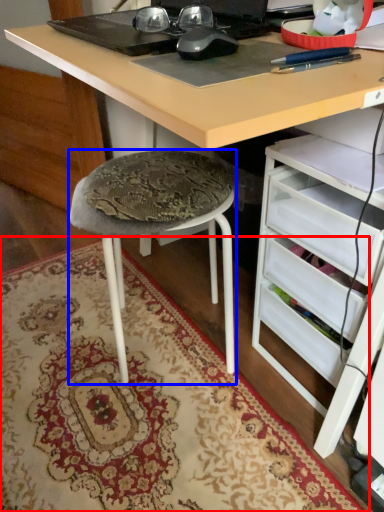
Question: Which object appears closest to the camera in this image, mat (highlighted by a red box) or stool (highlighted by a blue box)?

Choices:
 (A) mat
 (B) stool

Answer: (A)